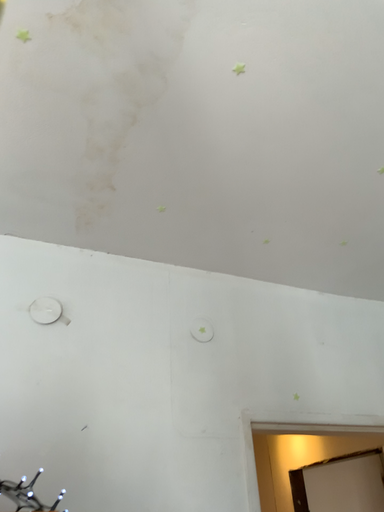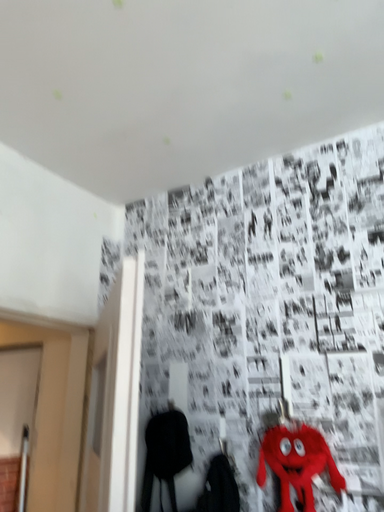
Question: How did the camera likely rotate when shooting the video?

Choices:
 (A) rotated downward
 (B) rotated upward

Answer: (A)